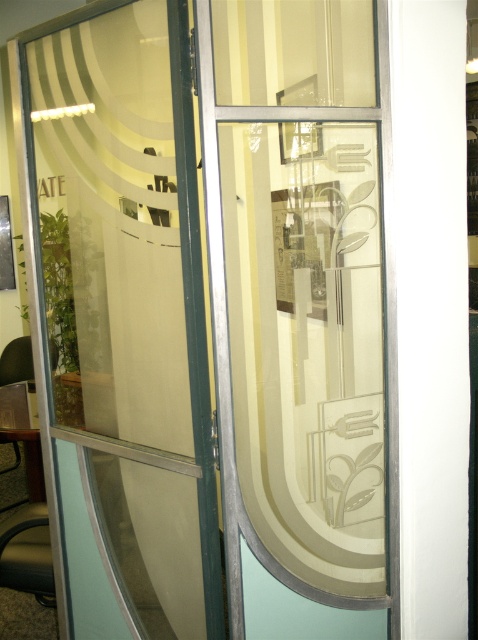
Does etched glass door at center appear on the left side of clear glass door at center?

No, etched glass door at center is not to the left of clear glass door at center.

Is point (344, 20) closer to camera compared to point (63, 490)?

That is True.

Locate an element on the screen. Image resolution: width=478 pixels, height=640 pixels. etched glass door at center is located at coordinates (300, 308).